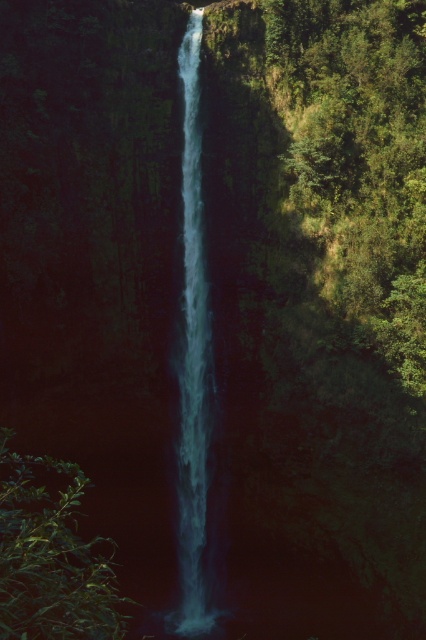
Question: Considering the real-world distances, which object is closest to the green leafy bush at lower left?

Choices:
 (A) clear blue water at center
 (B) green leafy vegetation at right

Answer: (A)

Question: Is green leafy vegetation at right wider than green leafy bush at lower left?

Choices:
 (A) yes
 (B) no

Answer: (B)

Question: Among these objects, which one is farthest from the camera?

Choices:
 (A) green leafy vegetation at right
 (B) green leafy bush at lower left
 (C) clear blue water at center

Answer: (C)

Question: Which of the following is the farthest from the observer?

Choices:
 (A) clear blue water at center
 (B) green leafy bush at lower left
 (C) green leafy vegetation at right

Answer: (A)

Question: Does green leafy bush at lower left have a larger size compared to clear blue water at center?

Choices:
 (A) no
 (B) yes

Answer: (B)

Question: Can you confirm if green leafy bush at lower left is thinner than clear blue water at center?

Choices:
 (A) yes
 (B) no

Answer: (B)